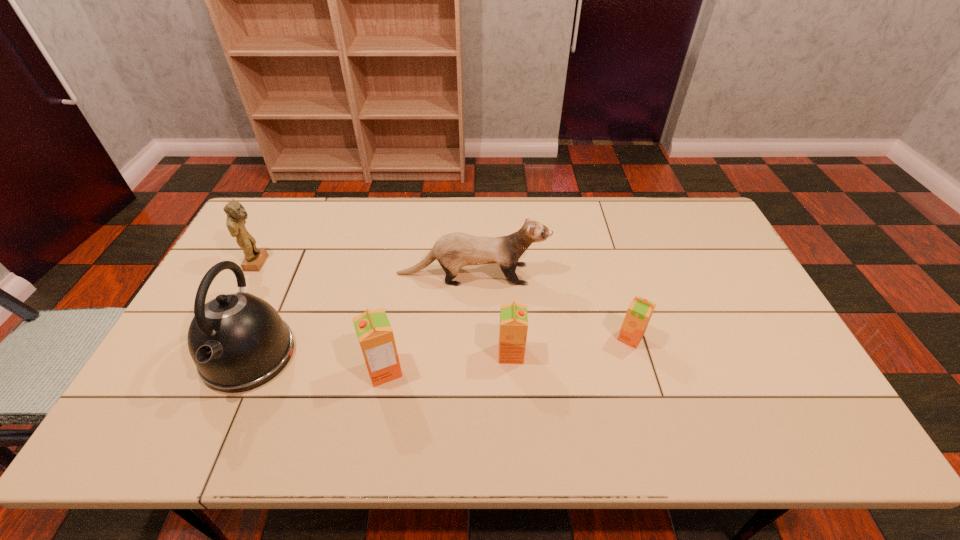
In the current image, all orange juices are evenly spaced. To maintain this equal spacing, where should an additional orange juice be placed on the right? Please point out a free spot. Please provide its 2D coordinates. Your answer should be formatted as a tuple, i.e. [(x, y)], where the tuple contains the x and y coordinates of a point satisfying the conditions above.

[(742, 323)]